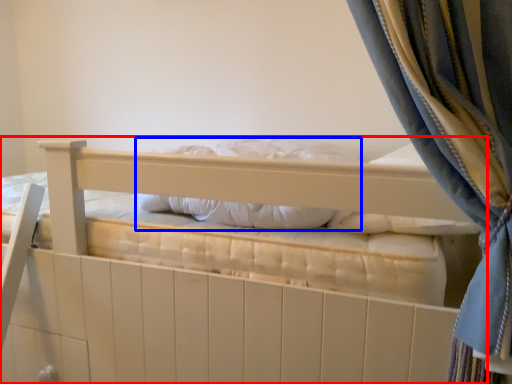
Question: Which of the following is the farthest to the observer, bed (highlighted by a red box) or pillow (highlighted by a blue box)?

Choices:
 (A) bed
 (B) pillow

Answer: (B)